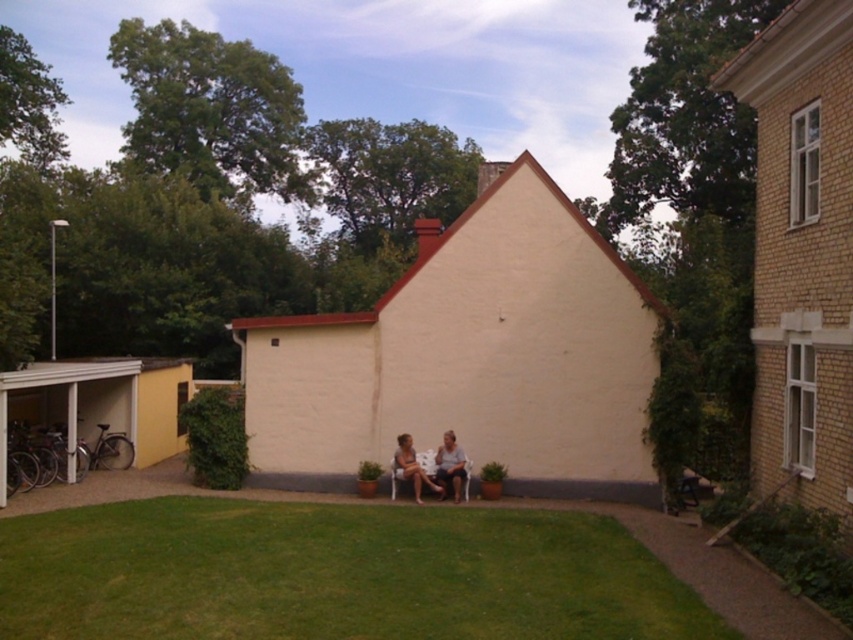
Question: In this image, where is matte white chairs at center located relative to smooth beige shirt at center?

Choices:
 (A) right
 (B) left

Answer: (B)

Question: Which point appears closest to the camera in this image?

Choices:
 (A) (445, 464)
 (B) (460, 472)

Answer: (B)

Question: Which of the following is the farthest from the observer?

Choices:
 (A) smooth beige shirt at center
 (B) matte white chairs at center

Answer: (A)

Question: Does matte white chairs at center have a lesser width compared to smooth beige shirt at center?

Choices:
 (A) yes
 (B) no

Answer: (B)

Question: Among these objects, which one is nearest to the camera?

Choices:
 (A) matte white chairs at center
 (B) smooth beige shirt at center

Answer: (A)

Question: Does matte white chairs at center have a smaller size compared to smooth beige shirt at center?

Choices:
 (A) yes
 (B) no

Answer: (B)